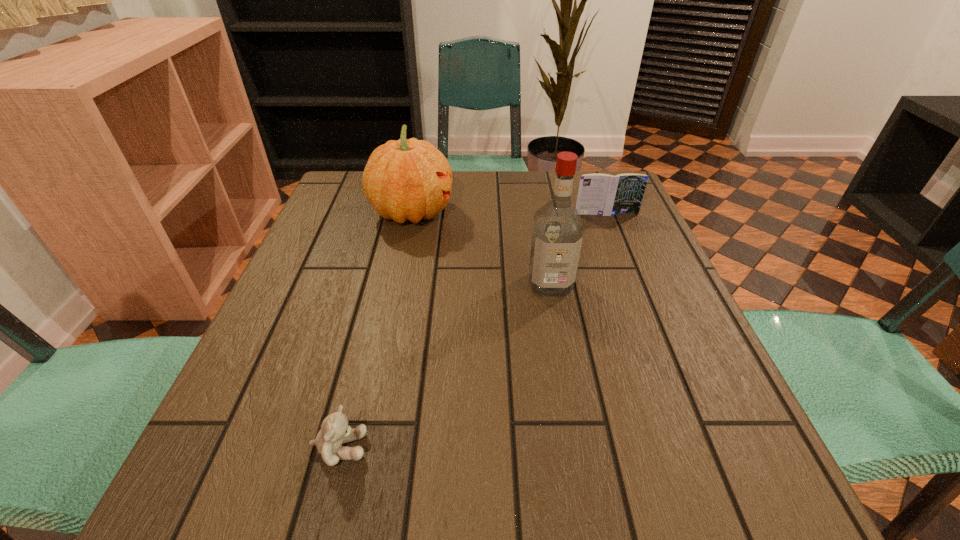
You are a GUI agent. You are given a task and a screenshot of the screen. Output one action in this format:
    pyautogui.click(x=<x>, y=<y>)
    Task: Click on the liquor
    The height and width of the screenshot is (540, 960).
    Given the screenshot: What is the action you would take?
    pyautogui.click(x=557, y=235)

The image size is (960, 540). I want to click on the third farthest object, so click(557, 235).

This screenshot has height=540, width=960. Identify the location of the second tallest object. (409, 179).

Where is `the rightmost object`? the rightmost object is located at coordinates (599, 194).

The width and height of the screenshot is (960, 540). I want to click on the third tallest object, so click(599, 194).

This screenshot has width=960, height=540. In order to click on the shortest object in this screenshot , I will do `click(335, 430)`.

The height and width of the screenshot is (540, 960). In order to click on the nearest object in this screenshot , I will do `click(335, 430)`.

Identify the location of vacant space located on the front-facing side of the liquor. The width and height of the screenshot is (960, 540). (557, 319).

Where is `vacant space located on the carved face of the pumpkin`? vacant space located on the carved face of the pumpkin is located at coordinates (575, 212).

Where is `blank area located 0.200m on the front cover of the rightmost object`? The height and width of the screenshot is (540, 960). blank area located 0.200m on the front cover of the rightmost object is located at coordinates (626, 265).